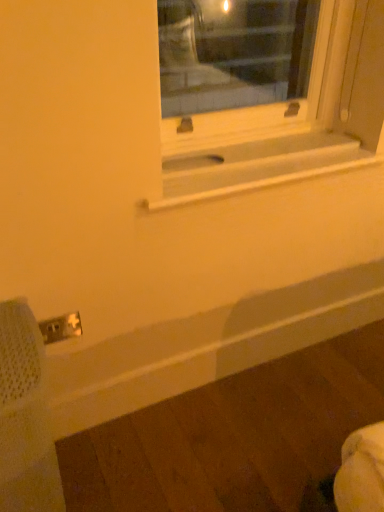
This screenshot has width=384, height=512. What do you see at coordinates (60, 328) in the screenshot?
I see `white plastic electric outlet at lower left` at bounding box center [60, 328].

Find the location of a particular element. This screenshot has width=384, height=512. metal mesh swivel chair at lower left is located at coordinates (25, 418).

Considering the relative sizes of metal mesh swivel chair at lower left and white matte window sill at center in the image provided, is metal mesh swivel chair at lower left wider than white matte window sill at center?

Yes, metal mesh swivel chair at lower left is wider than white matte window sill at center.

Based on their positions, is metal mesh swivel chair at lower left located to the left or right of white matte window sill at center?

metal mesh swivel chair at lower left is to the left of white matte window sill at center.

From a real-world perspective, does metal mesh swivel chair at lower left stand above white matte window sill at center?

No, from a real-world perspective, metal mesh swivel chair at lower left is not on top of white matte window sill at center.

Is metal mesh swivel chair at lower left facing towards white plastic electric outlet at lower left?

No, metal mesh swivel chair at lower left is not facing towards white plastic electric outlet at lower left.

From the image's perspective, which one is positioned higher, metal mesh swivel chair at lower left or white plastic electric outlet at lower left?

white plastic electric outlet at lower left is shown above in the image.

Can you confirm if metal mesh swivel chair at lower left is thinner than white plastic electric outlet at lower left?

In fact, metal mesh swivel chair at lower left might be wider than white plastic electric outlet at lower left.

In the image, there is a white plastic electric outlet at lower left. Where is `swivel chair below it (from the image's perspective)`? Image resolution: width=384 pixels, height=512 pixels. swivel chair below it (from the image's perspective) is located at coordinates (25, 418).

How different are the orientations of white plastic electric outlet at lower left and white matte window sill at center in degrees?

The angular difference between white plastic electric outlet at lower left and white matte window sill at center is 0.978 degrees.

In terms of height, does white plastic electric outlet at lower left look taller or shorter compared to white matte window sill at center?

In the image, white plastic electric outlet at lower left appears to be taller than white matte window sill at center.

Are white plastic electric outlet at lower left and white matte window sill at center far apart?

white plastic electric outlet at lower left is actually quite close to white matte window sill at center.

Could you tell me if white plastic electric outlet at lower left is turned towards white matte window sill at center?

No, white plastic electric outlet at lower left is not oriented towards white matte window sill at center.

From the image's perspective, which one is positioned higher, white matte window sill at center or metal mesh swivel chair at lower left?

white matte window sill at center is shown above in the image.

Could metal mesh swivel chair at lower left be considered to be inside white matte window sill at center?

No, metal mesh swivel chair at lower left is not a part of white matte window sill at center.

Does point (278, 158) lie in front of point (5, 498)?

No, (278, 158) is behind (5, 498).

Is white matte window sill at center not close to metal mesh swivel chair at lower left?

Answer: Actually, white matte window sill at center and metal mesh swivel chair at lower left are a little close together.

Is white matte window sill at center completely or partially outside of white plastic electric outlet at lower left?

white matte window sill at center lies outside white plastic electric outlet at lower left's area.

Can you confirm if white matte window sill at center is positioned to the right of white plastic electric outlet at lower left?

Yes.

Between white matte window sill at center and white plastic electric outlet at lower left, which one is positioned in front?

white matte window sill at center is in front.

What's the angular difference between white matte window sill at center and white plastic electric outlet at lower left's facing directions?

The facing directions of white matte window sill at center and white plastic electric outlet at lower left are 0.978 degrees apart.

Is white plastic electric outlet at lower left next to metal mesh swivel chair at lower left and touching it?

No, white plastic electric outlet at lower left is not touching metal mesh swivel chair at lower left.

You are a GUI agent. You are given a task and a screenshot of the screen. Output one action in this format:
    pyautogui.click(x=<x>, y=<y>)
    Task: Click on the electric outlet lying behind the metal mesh swivel chair at lower left
    
    Given the screenshot: What is the action you would take?
    pyautogui.click(x=60, y=328)

In terms of size, does white plastic electric outlet at lower left appear bigger or smaller than metal mesh swivel chair at lower left?

Considering their sizes, white plastic electric outlet at lower left takes up less space than metal mesh swivel chair at lower left.

Considering the relative positions of white plastic electric outlet at lower left and metal mesh swivel chair at lower left in the image provided, is white plastic electric outlet at lower left behind metal mesh swivel chair at lower left?

Yes, the depth of white plastic electric outlet at lower left is greater than that of metal mesh swivel chair at lower left.

What are the coordinates of `swivel chair that is in front of the white matte window sill at center` in the screenshot? It's located at (25, 418).

This screenshot has height=512, width=384. I want to click on electric outlet above the metal mesh swivel chair at lower left (from a real-world perspective), so click(60, 328).

Looking at this image, based on their spatial positions, is white matte window sill at center or metal mesh swivel chair at lower left further from white plastic electric outlet at lower left?

white matte window sill at center is positioned further to the anchor white plastic electric outlet at lower left.

When comparing their distances from metal mesh swivel chair at lower left, does white plastic electric outlet at lower left or white matte window sill at center seem closer?

white plastic electric outlet at lower left.

When comparing their distances from white matte window sill at center, does metal mesh swivel chair at lower left or white plastic electric outlet at lower left seem further?

metal mesh swivel chair at lower left is further to white matte window sill at center.

Looking at the image, which one is located further to metal mesh swivel chair at lower left, white matte window sill at center or white plastic electric outlet at lower left?

white matte window sill at center lies further to metal mesh swivel chair at lower left than the other object.

Which object lies further to the anchor point white matte window sill at center, white plastic electric outlet at lower left or metal mesh swivel chair at lower left?

metal mesh swivel chair at lower left is positioned further to the anchor white matte window sill at center.

Estimate the real-world distances between objects in this image. Which object is further from white plastic electric outlet at lower left, metal mesh swivel chair at lower left or white matte window sill at center?

white matte window sill at center lies further to white plastic electric outlet at lower left than the other object.

Where is `electric outlet that lies between white matte window sill at center and metal mesh swivel chair at lower left from top to bottom`? Image resolution: width=384 pixels, height=512 pixels. electric outlet that lies between white matte window sill at center and metal mesh swivel chair at lower left from top to bottom is located at coordinates (60, 328).